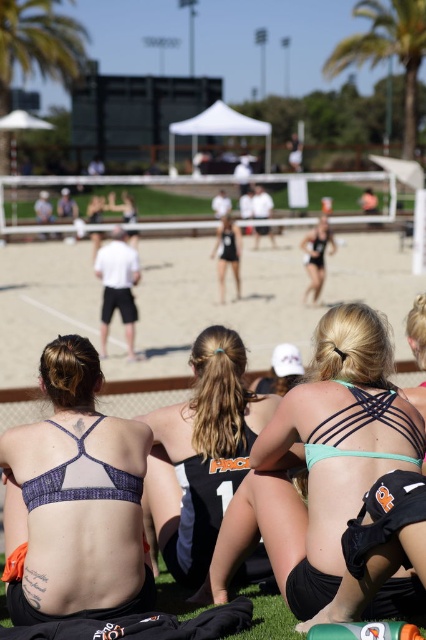
Question: Among these points, which one is nearest to the camera?

Choices:
 (A) (184, 452)
 (B) (218, 241)
 (C) (336, 74)

Answer: (A)

Question: Is teal fabric bikini top at center above matte black bikini top at center?

Choices:
 (A) no
 (B) yes

Answer: (A)

Question: From the image, what is the correct spatial relationship of green leafy palm tree at upper left in relation to green leafy palm tree at upper center?

Choices:
 (A) below
 (B) above

Answer: (B)

Question: Among these objects, which one is farthest from the camera?

Choices:
 (A) sandy beach at center
 (B) green leafy palm tree at upper center

Answer: (B)

Question: Which object appears closest to the camera in this image?

Choices:
 (A) teal fabric bikini top at center
 (B) matte black bikini top at center
 (C) black mesh tank top at center
 (D) green leafy palm tree at upper center

Answer: (A)

Question: Can you confirm if matte purple bikini top at center is smaller than matte black bikini top at center?

Choices:
 (A) no
 (B) yes

Answer: (B)